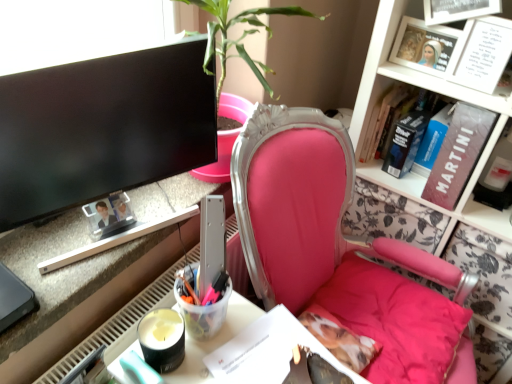
Where is `free space above metallic silver desk at lower left (from a real-world perspective)`? This screenshot has height=384, width=512. free space above metallic silver desk at lower left (from a real-world perspective) is located at coordinates (66, 249).